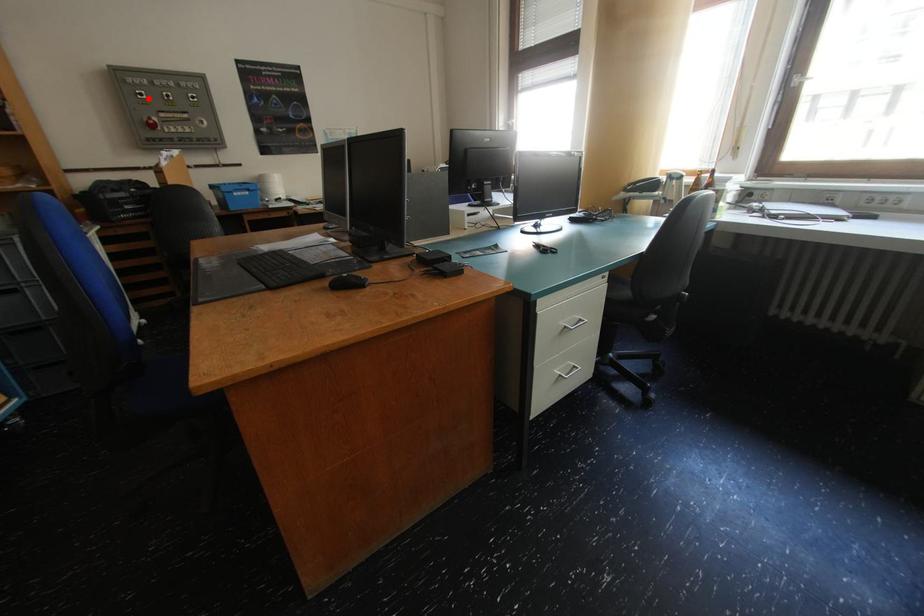
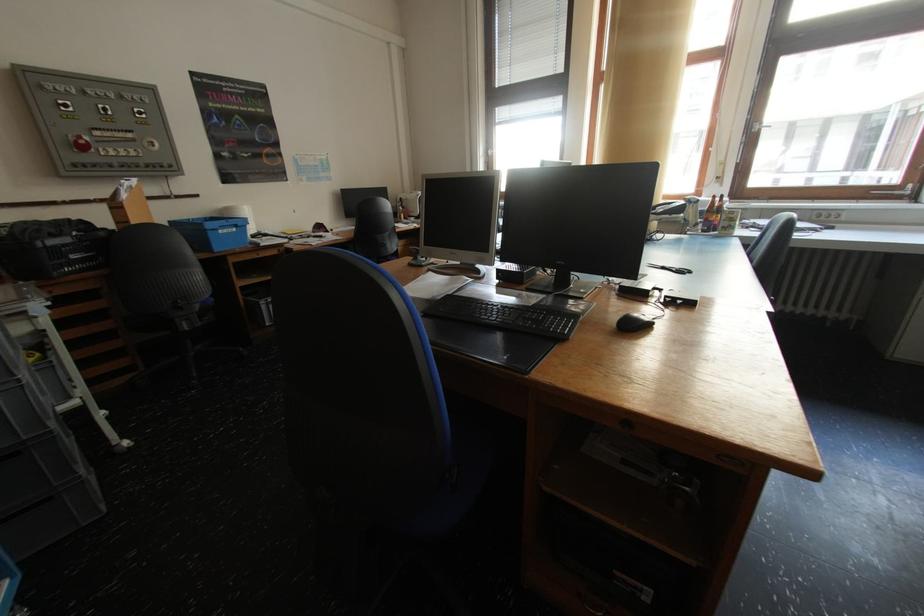
Find the pixel in the second image that matches the highlighted location in the first image.

(71, 110)